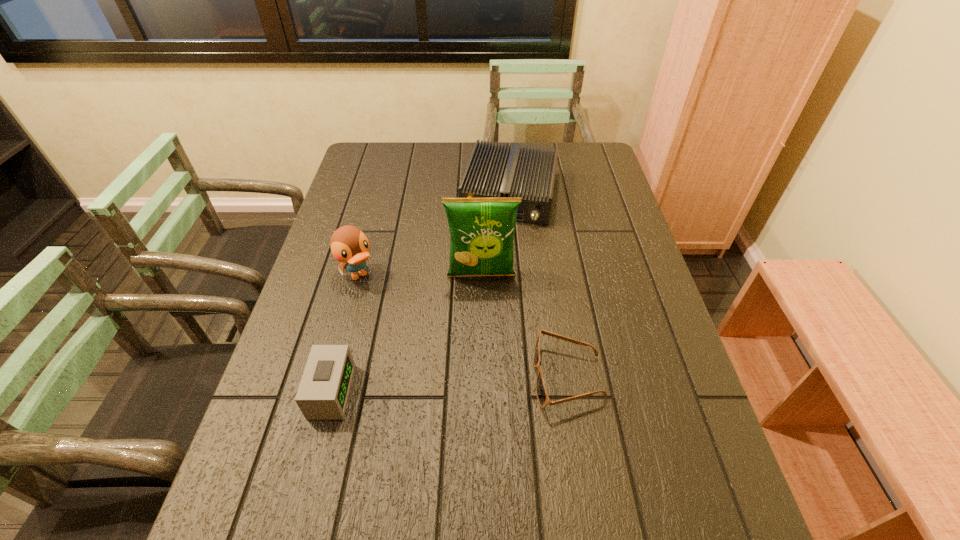
Identify the location of free point that satisfies the following two spatial constraints: 1. on the back side of the farthest object; 2. on the left side of the fourth shortest object. (380, 194).